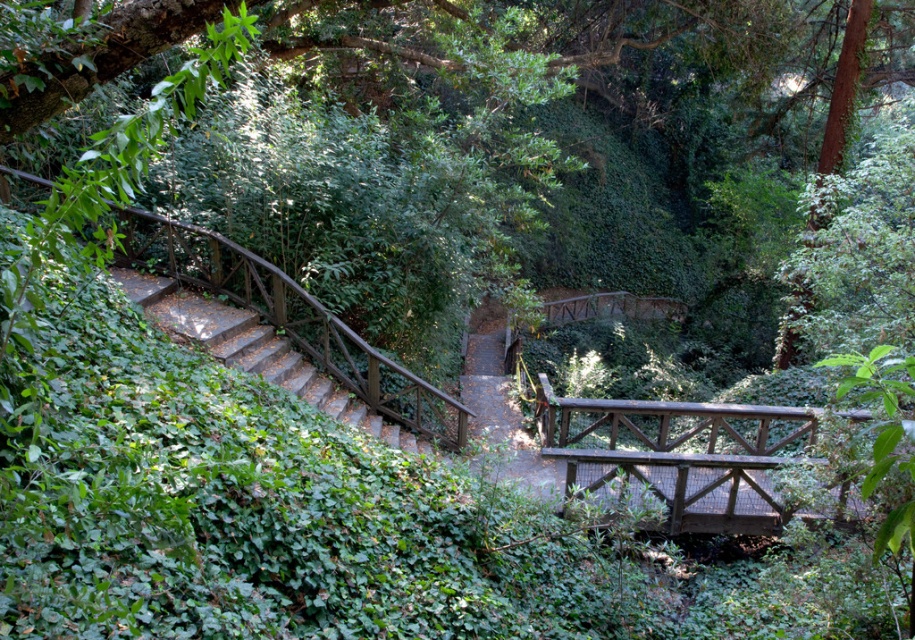
Who is more forward, (569, 410) or (242, 358)?

Point (242, 358) is more forward.

Who is more forward, (760, 513) or (451, 413)?

Point (760, 513) is in front.

The height and width of the screenshot is (640, 915). Identify the location of wooden bridge at center. (677, 456).